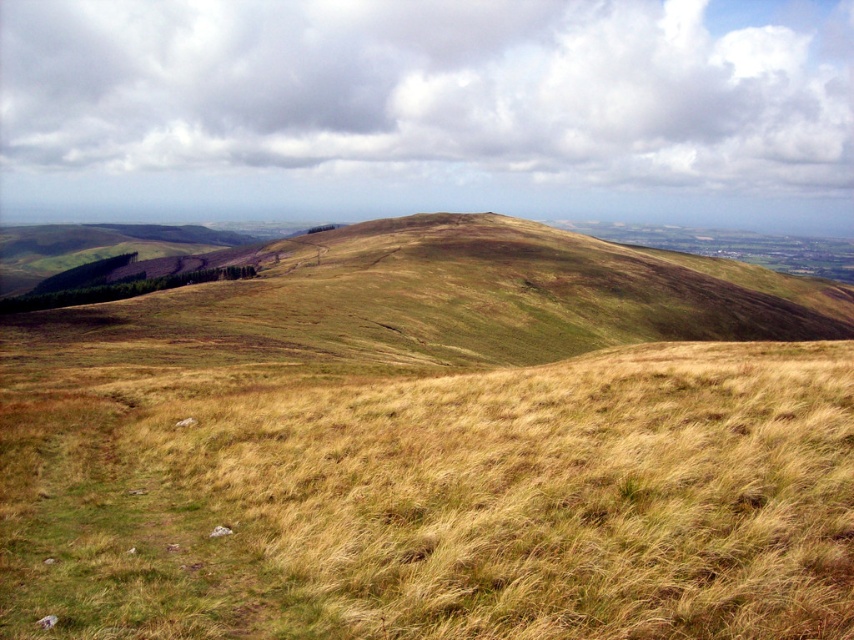
Consider the image. Is dry grass at center further to camera compared to green grassy hillside at center?

No, dry grass at center is closer to the viewer.

Can you confirm if dry grass at center is smaller than green grassy hillside at center?

Yes, dry grass at center is smaller than green grassy hillside at center.

The height and width of the screenshot is (640, 854). Find the location of `dry grass at center`. dry grass at center is located at coordinates (442, 500).

Locate an element on the screen. Image resolution: width=854 pixels, height=640 pixels. dry grass at center is located at coordinates (442, 500).